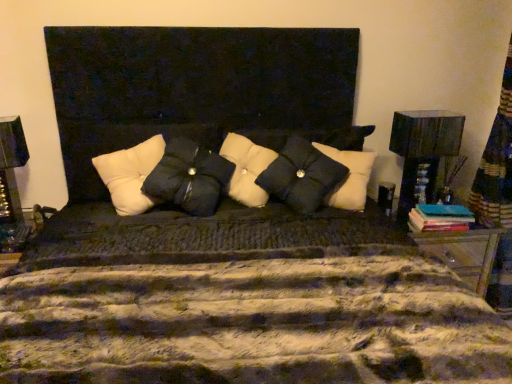
Measure the distance between point (128, 204) and camera.

A distance of 5.43 feet exists between point (128, 204) and camera.

What do you see at coordinates (423, 152) in the screenshot? Image resolution: width=512 pixels, height=384 pixels. I see `matte black lampshade at right` at bounding box center [423, 152].

Locate an element on the screen. Image resolution: width=512 pixels, height=384 pixels. black matte pillow at center, which is the second pillow in right-to-left order is located at coordinates (189, 178).

Identify the location of white tufted pillow at center, positioned as the 1th pillow in left-to-right order. The height and width of the screenshot is (384, 512). (130, 174).

Which object is further away from the camera, black matte pillow at center, which is the second pillow in right-to-left order, or matte black lampshade at right?

matte black lampshade at right is behind.

Can you see black matte pillow at center, placed as the second pillow when sorted from left to right, touching matte black lampshade at right?

black matte pillow at center, placed as the second pillow when sorted from left to right, is not next to matte black lampshade at right, and they're not touching.

Between black matte pillow at center, placed as the second pillow when sorted from left to right, and matte black lampshade at right, which one appears on the left side from the viewer's perspective?

Positioned to the left is black matte pillow at center, placed as the second pillow when sorted from left to right.

Does point (147, 141) come farther from viewer compared to point (285, 185)?

Yes.

Considering the relative sizes of white tufted pillow at center, arranged as the 3th pillow when viewed from the right, and black textured pillow at center, marked as the 3th pillow in a left-to-right arrangement, in the image provided, is white tufted pillow at center, arranged as the 3th pillow when viewed from the right, taller than black textured pillow at center, marked as the 3th pillow in a left-to-right arrangement,?

In fact, white tufted pillow at center, arranged as the 3th pillow when viewed from the right, may be shorter than black textured pillow at center, marked as the 3th pillow in a left-to-right arrangement.

Which is in front, white tufted pillow at center, arranged as the 3th pillow when viewed from the right, or black textured pillow at center, the first pillow positioned from the right?

white tufted pillow at center, arranged as the 3th pillow when viewed from the right, is more forward.

Could you tell me if white tufted pillow at center, arranged as the 3th pillow when viewed from the right, is facing black textured pillow at center, the first pillow positioned from the right?

No, white tufted pillow at center, arranged as the 3th pillow when viewed from the right, is not facing towards black textured pillow at center, the first pillow positioned from the right.

From a real-world perspective, which object stands above the other?

matte black lampshade at right.

Is matte black lampshade at right to the left or to the right of teal matte book at right in the image?

From the image, it's evident that matte black lampshade at right is to the left of teal matte book at right.

Is matte black lampshade at right spatially inside teal matte book at right, or outside of it?

matte black lampshade at right exists outside the volume of teal matte book at right.

In the scene shown: Which object is more forward, black textured pillow at center, the first pillow positioned from the right, or matte black lampshade at right?

black textured pillow at center, the first pillow positioned from the right.

From the image's perspective, between black textured pillow at center, the first pillow positioned from the right, and matte black lampshade at right, which one is located above?

From the image's view, matte black lampshade at right is above.

From a real-world perspective, who is located lower, black textured pillow at center, marked as the 3th pillow in a left-to-right arrangement, or matte black lampshade at right?

From a 3D spatial view, matte black lampshade at right is below.

Which point is more distant from viewer, (270, 177) or (407, 140)?

The point (407, 140) is behind.

Is white tufted pillow at center, arranged as the 3th pillow when viewed from the right, located outside matte black lampshade at right?

Yes.

Could you tell me if white tufted pillow at center, arranged as the 3th pillow when viewed from the right, is facing matte black lampshade at right?

No.

Find the location of `table lamp on the right side of white tufted pillow at center, arranged as the 3th pillow when viewed from the right`. table lamp on the right side of white tufted pillow at center, arranged as the 3th pillow when viewed from the right is located at coordinates (423, 152).

How many degrees apart are the facing directions of white tufted pillow at center, positioned as the 1th pillow in left-to-right order, and black matte pillow at center, placed as the second pillow when sorted from left to right?

The angular difference between white tufted pillow at center, positioned as the 1th pillow in left-to-right order, and black matte pillow at center, placed as the second pillow when sorted from left to right, is 3.06 degrees.

Is white tufted pillow at center, arranged as the 3th pillow when viewed from the right, located outside black matte pillow at center, which is the second pillow in right-to-left order?

No, white tufted pillow at center, arranged as the 3th pillow when viewed from the right, is not entirely external to black matte pillow at center, which is the second pillow in right-to-left order.

Between white tufted pillow at center, positioned as the 1th pillow in left-to-right order, and black matte pillow at center, placed as the second pillow when sorted from left to right, which one has less height?

white tufted pillow at center, positioned as the 1th pillow in left-to-right order, is shorter.

Measure the distance between black matte pillow at center, placed as the second pillow when sorted from left to right, and white tufted pillow at center, positioned as the 1th pillow in left-to-right order.

A distance of 11.77 centimeters exists between black matte pillow at center, placed as the second pillow when sorted from left to right, and white tufted pillow at center, positioned as the 1th pillow in left-to-right order.

Between point (219, 190) and point (137, 198), which one is positioned in front?

The point (137, 198) is in front.

Can you confirm if black matte pillow at center, which is the second pillow in right-to-left order, is bigger than white tufted pillow at center, positioned as the 1th pillow in left-to-right order?

Indeed, black matte pillow at center, which is the second pillow in right-to-left order, has a larger size compared to white tufted pillow at center, positioned as the 1th pillow in left-to-right order.

From a real-world perspective, which is physically below, black matte pillow at center, which is the second pillow in right-to-left order, or white tufted pillow at center, arranged as the 3th pillow when viewed from the right?

From a 3D spatial view, white tufted pillow at center, arranged as the 3th pillow when viewed from the right, is below.

Which pillow is the 2nd one when counting from the left side of the matte black lampshade at right? Please provide its 2D coordinates.

[(189, 178)]

Find the location of a particular element. The width and height of the screenshot is (512, 384). the 1st pillow located above the white tufted pillow at center, arranged as the 3th pillow when viewed from the right (from a real-world perspective) is located at coordinates (302, 176).

From the picture: Which object lies nearer to the anchor point black matte pillow at center, which is the second pillow in right-to-left order, teal matte book at right or black textured pillow at center, the first pillow positioned from the right?

black textured pillow at center, the first pillow positioned from the right, lies closer to black matte pillow at center, which is the second pillow in right-to-left order, than the other object.

When comparing their distances from matte black lampshade at right, does black matte pillow at center, placed as the second pillow when sorted from left to right, or teal matte book at right seem further?

black matte pillow at center, placed as the second pillow when sorted from left to right, is positioned further to the anchor matte black lampshade at right.

Estimate the real-world distances between objects in this image. Which object is closer to white tufted pillow at center, positioned as the 1th pillow in left-to-right order, teal matte book at right or black textured pillow at center, the first pillow positioned from the right?

black textured pillow at center, the first pillow positioned from the right.

Consider the image. Estimate the real-world distances between objects in this image. Which object is closer to white tufted pillow at center, arranged as the 3th pillow when viewed from the right, black textured pillow at center, the first pillow positioned from the right, or black matte pillow at center, placed as the second pillow when sorted from left to right?

The object closer to white tufted pillow at center, arranged as the 3th pillow when viewed from the right, is black matte pillow at center, placed as the second pillow when sorted from left to right.

Considering their positions, is white tufted pillow at center, arranged as the 3th pillow when viewed from the right, positioned closer to black matte pillow at center, placed as the second pillow when sorted from left to right, than teal matte book at right?

Among the two, white tufted pillow at center, arranged as the 3th pillow when viewed from the right, is located nearer to black matte pillow at center, placed as the second pillow when sorted from left to right.

Looking at the image, which one is located further to black textured pillow at center, marked as the 3th pillow in a left-to-right arrangement, teal matte book at right or matte black lampshade at right?

teal matte book at right is further to black textured pillow at center, marked as the 3th pillow in a left-to-right arrangement.

When comparing their distances from black textured pillow at center, the first pillow positioned from the right, does teal matte book at right or white tufted pillow at center, arranged as the 3th pillow when viewed from the right, seem closer?

teal matte book at right is closer to black textured pillow at center, the first pillow positioned from the right.

From the image, which object appears to be farther from matte black lampshade at right, teal matte book at right or black textured pillow at center, marked as the 3th pillow in a left-to-right arrangement?

Based on the image, black textured pillow at center, marked as the 3th pillow in a left-to-right arrangement, appears to be further to matte black lampshade at right.

The height and width of the screenshot is (384, 512). I want to click on table lamp between white tufted pillow at center, arranged as the 3th pillow when viewed from the right, and teal matte book at right from left to right, so click(423, 152).

Find the location of a particular element. pillow between black matte pillow at center, placed as the second pillow when sorted from left to right, and matte black lampshade at right from left to right is located at coordinates (302, 176).

Where is `pillow located between black matte pillow at center, placed as the second pillow when sorted from left to right, and teal matte book at right in the left-right direction`? Image resolution: width=512 pixels, height=384 pixels. pillow located between black matte pillow at center, placed as the second pillow when sorted from left to right, and teal matte book at right in the left-right direction is located at coordinates (302, 176).

Where is `table lamp situated between black textured pillow at center, marked as the 3th pillow in a left-to-right arrangement, and teal matte book at right from left to right`? table lamp situated between black textured pillow at center, marked as the 3th pillow in a left-to-right arrangement, and teal matte book at right from left to right is located at coordinates (423, 152).